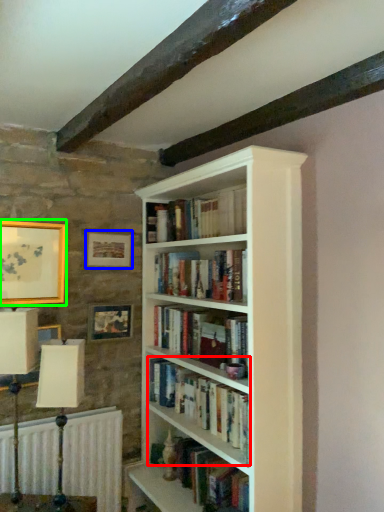
Question: Which is farther away from book (highlighted by a red box)? picture frame (highlighted by a blue box) or picture frame (highlighted by a green box)?

Choices:
 (A) picture frame
 (B) picture frame

Answer: (B)